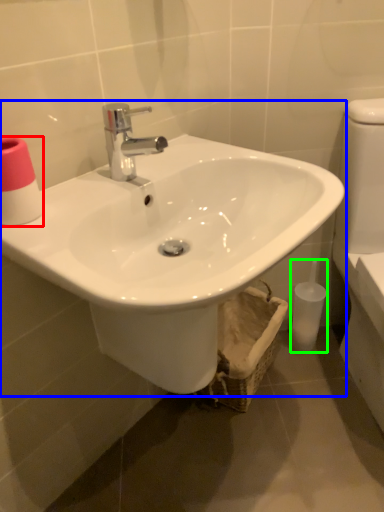
Question: Based on their relative distances, which object is farther from toilet paper (highlighted by a red box)? Choose from sink (highlighted by a blue box) and toiletry (highlighted by a green box).

Choices:
 (A) sink
 (B) toiletry

Answer: (B)